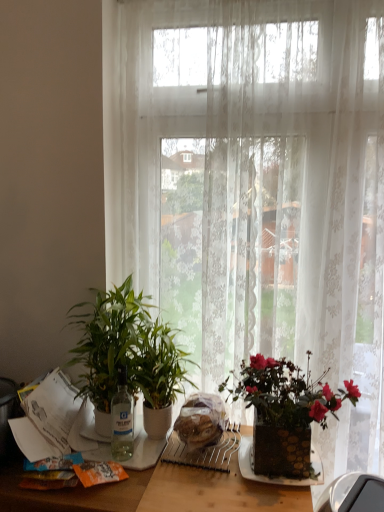
Question: Is wooden table at center touching green glossy plant at left, the second houseplant positioned from the right?

Choices:
 (A) no
 (B) yes

Answer: (A)

Question: Can green glossy plant at left, marked as the 1th houseplant in a left-to-right arrangement, be found inside wooden table at center?

Choices:
 (A) no
 (B) yes

Answer: (A)

Question: Considering the relative positions of wooden table at center and green glossy plant at left, the second houseplant positioned from the right, in the image provided, is wooden table at center to the right of green glossy plant at left, the second houseplant positioned from the right, from the viewer's perspective?

Choices:
 (A) no
 (B) yes

Answer: (B)

Question: Is wooden table at center far from green glossy plant at left, the second houseplant positioned from the right?

Choices:
 (A) no
 (B) yes

Answer: (A)

Question: From a real-world perspective, is wooden table at center physically above green glossy plant at left, marked as the 1th houseplant in a left-to-right arrangement?

Choices:
 (A) yes
 (B) no

Answer: (B)

Question: Is wooden table at center outside green glossy plant at left, the second houseplant positioned from the right?

Choices:
 (A) no
 (B) yes

Answer: (B)

Question: Does translucent plastic bread at center appear on the left side of green glossy plant at left, marked as the 1th houseplant in a left-to-right arrangement?

Choices:
 (A) no
 (B) yes

Answer: (A)

Question: Could you tell me if translucent plastic bread at center is facing green glossy plant at left, the second houseplant positioned from the right?

Choices:
 (A) no
 (B) yes

Answer: (A)

Question: Does translucent plastic bread at center have a lesser width compared to green glossy plant at left, marked as the 1th houseplant in a left-to-right arrangement?

Choices:
 (A) yes
 (B) no

Answer: (A)

Question: Is translucent plastic bread at center turned away from green glossy plant at left, the second houseplant positioned from the right?

Choices:
 (A) no
 (B) yes

Answer: (A)

Question: Is translucent plastic bread at center outside of green glossy plant at left, marked as the 1th houseplant in a left-to-right arrangement?

Choices:
 (A) no
 (B) yes

Answer: (B)

Question: Can you confirm if translucent plastic bread at center is smaller than green glossy plant at left, marked as the 1th houseplant in a left-to-right arrangement?

Choices:
 (A) yes
 (B) no

Answer: (A)

Question: Is transparent glass bottle at center not inside green glossy plant at left, marked as the 1th houseplant in a left-to-right arrangement?

Choices:
 (A) yes
 (B) no

Answer: (B)